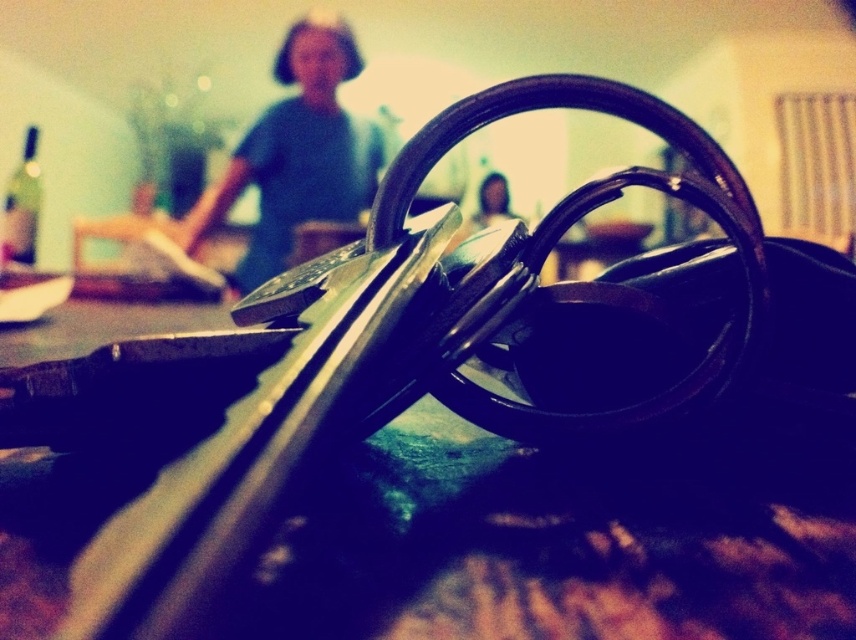
Question: Does metallic black keys at center lie behind blue fabric shirt at upper center?

Choices:
 (A) yes
 (B) no

Answer: (B)

Question: Does metallic black keys at center have a larger size compared to blue fabric shirt at upper center?

Choices:
 (A) no
 (B) yes

Answer: (A)

Question: Among these objects, which one is farthest from the camera?

Choices:
 (A) metallic black keys at center
 (B) smooth skin face at center
 (C) blue fabric shirt at upper center

Answer: (B)

Question: Is metallic black keys at center positioned behind blue fabric shirt at upper center?

Choices:
 (A) yes
 (B) no

Answer: (B)

Question: Which object is positioned closest to the metallic black keys at center?

Choices:
 (A) blue fabric shirt at upper center
 (B) smooth skin face at center

Answer: (B)

Question: Among these objects, which one is farthest from the camera?

Choices:
 (A) metallic black keys at center
 (B) smooth skin face at center
 (C) blue fabric shirt at upper center

Answer: (B)